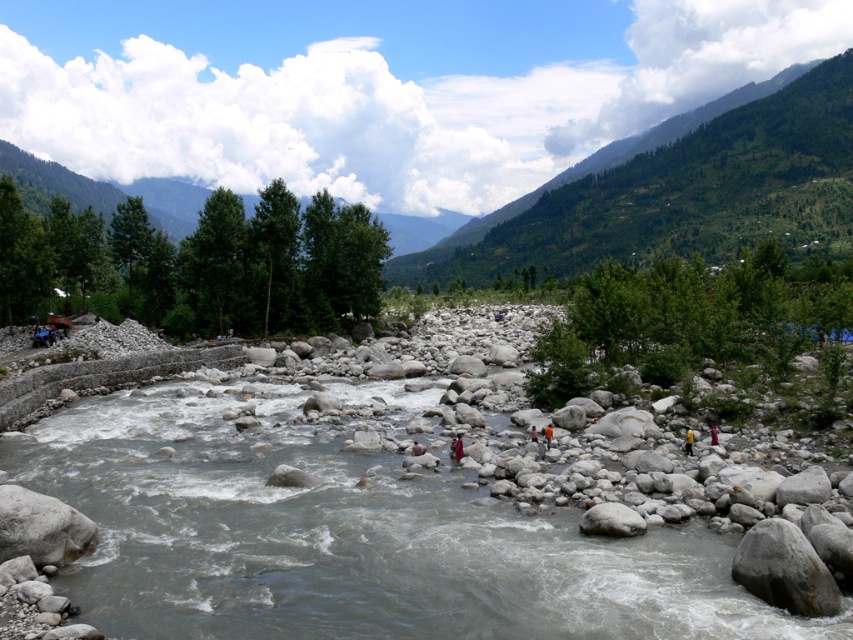
Question: Among these points, which one is nearest to the camera?

Choices:
 (A) (505, 236)
 (B) (456, 438)

Answer: (B)

Question: Among these points, which one is nearest to the camera?

Choices:
 (A) (817, 67)
 (B) (454, 442)
 (C) (691, 451)

Answer: (C)

Question: Based on their relative distances, which object is farther from the yellow fabric at center?

Choices:
 (A) green leafy mountain at upper right
 (B) red fabric person at center

Answer: (A)

Question: Does green leafy mountain at upper right appear on the left side of red fabric person at center?

Choices:
 (A) yes
 (B) no

Answer: (B)

Question: In this image, where is red fabric person at center located relative to yellow fabric at center?

Choices:
 (A) below
 (B) above

Answer: (A)

Question: Does green leafy mountain at upper right have a larger size compared to yellow fabric at center?

Choices:
 (A) yes
 (B) no

Answer: (A)